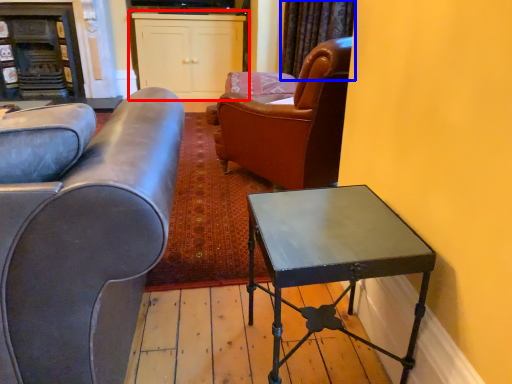
Question: Among these objects, which one is nearest to the camera, cabinetry (highlighted by a red box) or curtain (highlighted by a blue box)?

Choices:
 (A) cabinetry
 (B) curtain

Answer: (B)